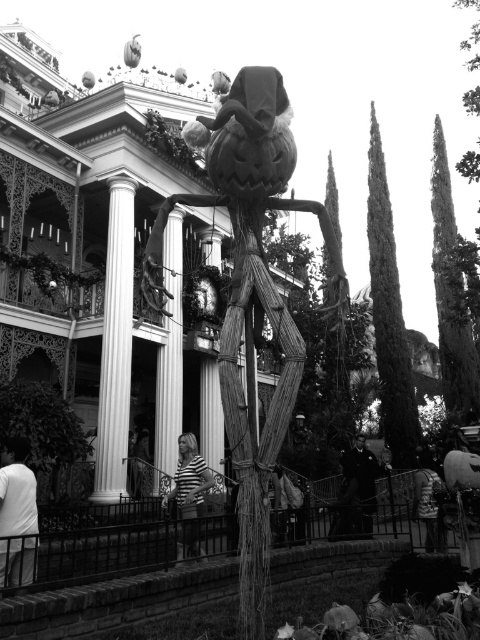
You are standing at the entrance of the mansion and see two points marked in the image. The first point is at coordinates point [225,378] and the second is at point [2,506]. Which point is closer to you?

Point [225,378] is in front of point [2,506], so it is closer to you.

You are a guest at the Halloween event and want to take a photo with both the wooden pumpkin at center and the striped fabric person at center. Which object will appear larger in the photo?

The wooden pumpkin at center will appear larger in the photo because it is much taller than the striped fabric person at center according to the description.

You are a guest at the Halloween event and want to find the wooden pumpkin at center. From the white fabric at lower left, in which direction should you move to locate it?

The wooden pumpkin at center is to the right of the white fabric at lower left. So you should move to the right from the white fabric at lower left to locate the wooden pumpkin at center.